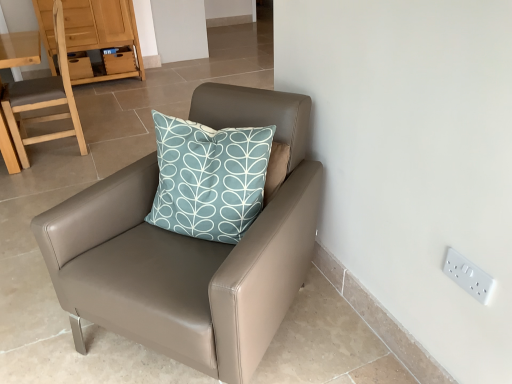
This screenshot has height=384, width=512. Describe the element at coordinates (468, 276) in the screenshot. I see `white plastic electric outlet at upper right` at that location.

I want to click on matte leather chair at center, the 1th chair positioned from the right, so click(190, 250).

From a real-world perspective, does white plastic electric outlet at upper right stand above matte wood dresser at upper left?

Yes.

How distant is white plastic electric outlet at upper right from matte wood dresser at upper left?

A distance of 4.02 meters exists between white plastic electric outlet at upper right and matte wood dresser at upper left.

Is matte wood dresser at upper left surrounded by white plastic electric outlet at upper right?

No.

Which of these two, white plastic electric outlet at upper right or matte wood dresser at upper left, is wider?

matte wood dresser at upper left.

Which object is thinner, matte leather chair at center, the 1th chair from the front, or light brown wooden chair at left, arranged as the 1th chair when viewed from the left?

light brown wooden chair at left, arranged as the 1th chair when viewed from the left, is thinner.

From a real-world perspective, is matte leather chair at center, the 1th chair from the front, physically above light brown wooden chair at left, which is counted as the first chair, starting from the back?

Actually, matte leather chair at center, the 1th chair from the front, is physically below light brown wooden chair at left, which is counted as the first chair, starting from the back, in the real world.

Between matte leather chair at center, which is the 2th chair from left to right, and light brown wooden chair at left, arranged as the 1th chair when viewed from the left, which one has smaller size?

Smaller between the two is light brown wooden chair at left, arranged as the 1th chair when viewed from the left.

Is white plastic electric outlet at upper right bigger than matte leather chair at center, which appears as the second chair when viewed from the back?

No, white plastic electric outlet at upper right is not bigger than matte leather chair at center, which appears as the second chair when viewed from the back.

Would you consider white plastic electric outlet at upper right to be distant from matte leather chair at center, which is the 2th chair from left to right?

white plastic electric outlet at upper right is actually quite close to matte leather chair at center, which is the 2th chair from left to right.

Consider the image. From the image's perspective, which is above, white plastic electric outlet at upper right or matte leather chair at center, which appears as the second chair when viewed from the back?

matte leather chair at center, which appears as the second chair when viewed from the back, is shown above in the image.

Is matte leather chair at center, which appears as the second chair when viewed from the back, oriented towards matte wood dresser at upper left?

No, matte leather chair at center, which appears as the second chair when viewed from the back, is not turned towards matte wood dresser at upper left.

From a real-world perspective, between matte leather chair at center, the 1th chair from the front, and matte wood dresser at upper left, who is vertically higher?

matte wood dresser at upper left, from a real-world perspective.

Looking at their sizes, would you say matte leather chair at center, which is the 2th chair from left to right, is wider or thinner than matte wood dresser at upper left?

Clearly, matte leather chair at center, which is the 2th chair from left to right, has more width compared to matte wood dresser at upper left.

The width and height of the screenshot is (512, 384). What are the coordinates of `dresser that is behind the matte leather chair at center, which is the 2th chair from left to right` in the screenshot? It's located at (102, 32).

Considering the relative sizes of light brown wooden chair at left, which is the second chair in front-to-back order, and matte leather chair at center, which is the 2th chair from left to right, in the image provided, is light brown wooden chair at left, which is the second chair in front-to-back order, taller than matte leather chair at center, which is the 2th chair from left to right,?

Correct, light brown wooden chair at left, which is the second chair in front-to-back order, is much taller as matte leather chair at center, which is the 2th chair from left to right.

Between light brown wooden chair at left, arranged as the 1th chair when viewed from the left, and matte leather chair at center, the 1th chair positioned from the right, which one has larger size?

matte leather chair at center, the 1th chair positioned from the right.

From a real-world perspective, is light brown wooden chair at left, which is counted as the first chair, starting from the back, on matte leather chair at center, the 1th chair positioned from the right?

Yes, from a real-world perspective, light brown wooden chair at left, which is counted as the first chair, starting from the back, is on top of matte leather chair at center, the 1th chair positioned from the right.

Is light brown wooden chair at left, which ranks as the second chair in right-to-left order, in contact with matte leather chair at center, which is the 2th chair from left to right?

No, light brown wooden chair at left, which ranks as the second chair in right-to-left order, is not beside matte leather chair at center, which is the 2th chair from left to right.

From a real-world perspective, is matte wood dresser at upper left positioned over light brown wooden chair at left, which ranks as the second chair in right-to-left order, based on gravity?

No, from a real-world perspective, matte wood dresser at upper left is not above light brown wooden chair at left, which ranks as the second chair in right-to-left order.

From the image's perspective, between matte wood dresser at upper left and light brown wooden chair at left, which is the second chair in front-to-back order, which one is located above?

From the image's view, matte wood dresser at upper left is above.

In the image, is matte wood dresser at upper left positioned in front of or behind light brown wooden chair at left, which is counted as the first chair, starting from the back?

matte wood dresser at upper left is positioned farther from the viewer than light brown wooden chair at left, which is counted as the first chair, starting from the back.

Considering the sizes of matte wood dresser at upper left and light brown wooden chair at left, which ranks as the second chair in right-to-left order, in the image, is matte wood dresser at upper left bigger or smaller than light brown wooden chair at left, which ranks as the second chair in right-to-left order,?

matte wood dresser at upper left is bigger than light brown wooden chair at left, which ranks as the second chair in right-to-left order.

Considering the sizes of objects white plastic electric outlet at upper right and light brown wooden chair at left, which ranks as the second chair in right-to-left order, in the image provided, who is bigger, white plastic electric outlet at upper right or light brown wooden chair at left, which ranks as the second chair in right-to-left order,?

light brown wooden chair at left, which ranks as the second chair in right-to-left order, is bigger.

Is white plastic electric outlet at upper right positioned with its back to light brown wooden chair at left, which ranks as the second chair in right-to-left order?

No, white plastic electric outlet at upper right is not facing the opposite direction of light brown wooden chair at left, which ranks as the second chair in right-to-left order.

From a real-world perspective, which is physically above, white plastic electric outlet at upper right or light brown wooden chair at left, arranged as the 1th chair when viewed from the left?

light brown wooden chair at left, arranged as the 1th chair when viewed from the left, from a real-world perspective.

The image size is (512, 384). In order to click on dresser that is above the white plastic electric outlet at upper right (from the image's perspective) in this screenshot , I will do `click(102, 32)`.

The width and height of the screenshot is (512, 384). Find the location of `chair lying below the light brown wooden chair at left, which is the second chair in front-to-back order (from the image's perspective)`. chair lying below the light brown wooden chair at left, which is the second chair in front-to-back order (from the image's perspective) is located at coordinates (190, 250).

Which object lies further to the anchor point matte wood dresser at upper left, light brown wooden chair at left, arranged as the 1th chair when viewed from the left, or matte leather chair at center, the 1th chair positioned from the right?

Based on the image, matte leather chair at center, the 1th chair positioned from the right, appears to be further to matte wood dresser at upper left.

Looking at this image, looking at the image, which one is located further to matte wood dresser at upper left, light brown wooden chair at left, which is the second chair in front-to-back order, or white plastic electric outlet at upper right?

white plastic electric outlet at upper right is positioned further to the anchor matte wood dresser at upper left.

Which object lies nearer to the anchor point matte wood dresser at upper left, matte leather chair at center, which is the 2th chair from left to right, or white plastic electric outlet at upper right?

Based on the image, matte leather chair at center, which is the 2th chair from left to right, appears to be nearer to matte wood dresser at upper left.

Looking at this image, which object lies further to the anchor point white plastic electric outlet at upper right, light brown wooden chair at left, arranged as the 1th chair when viewed from the left, or matte leather chair at center, the 1th chair positioned from the right?

Among the two, light brown wooden chair at left, arranged as the 1th chair when viewed from the left, is located further to white plastic electric outlet at upper right.

Which object lies nearer to the anchor point matte leather chair at center, the 1th chair from the front, white plastic electric outlet at upper right or matte wood dresser at upper left?

white plastic electric outlet at upper right lies closer to matte leather chair at center, the 1th chair from the front, than the other object.

Estimate the real-world distances between objects in this image. Which object is further from white plastic electric outlet at upper right, matte wood dresser at upper left or matte leather chair at center, which is the 2th chair from left to right?

matte wood dresser at upper left is positioned further to the anchor white plastic electric outlet at upper right.

When comparing their distances from matte wood dresser at upper left, does white plastic electric outlet at upper right or light brown wooden chair at left, arranged as the 1th chair when viewed from the left, seem closer?

light brown wooden chair at left, arranged as the 1th chair when viewed from the left, is positioned closer to the anchor matte wood dresser at upper left.

Estimate the real-world distances between objects in this image. Which object is closer to white plastic electric outlet at upper right, light brown wooden chair at left, which is the second chair in front-to-back order, or matte wood dresser at upper left?

light brown wooden chair at left, which is the second chair in front-to-back order, is positioned closer to the anchor white plastic electric outlet at upper right.

Identify the location of chair between light brown wooden chair at left, which is the second chair in front-to-back order, and white plastic electric outlet at upper right, in the horizontal direction. This screenshot has height=384, width=512. [x=190, y=250].

Locate an element on the screen. chair located between white plastic electric outlet at upper right and matte wood dresser at upper left in the depth direction is located at coordinates (42, 99).

Find the location of `electric outlet between matte leather chair at center, which appears as the second chair when viewed from the back, and matte wood dresser at upper left, along the z-axis`. electric outlet between matte leather chair at center, which appears as the second chair when viewed from the back, and matte wood dresser at upper left, along the z-axis is located at coordinates pos(468,276).

Locate an element on the screen. chair positioned between matte leather chair at center, which is the 2th chair from left to right, and matte wood dresser at upper left from near to far is located at coordinates (42, 99).